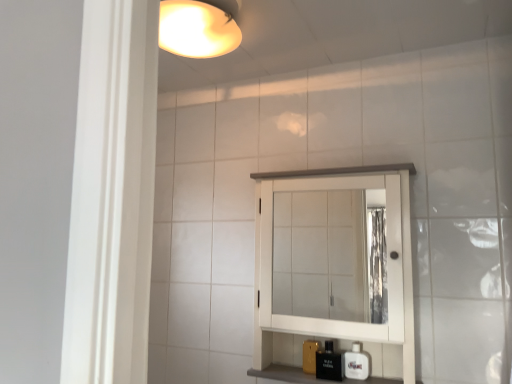
Question: Is white wood medicine cabinet at center bigger or smaller than black glossy bottle at lower center?

Choices:
 (A) small
 (B) big

Answer: (B)

Question: Is white wood medicine cabinet at center taller or shorter than black glossy bottle at lower center?

Choices:
 (A) tall
 (B) short

Answer: (A)

Question: Considering the real-world distances, which object is farthest from the white glossy soap dispenser at lower right?

Choices:
 (A) black glossy bottle at lower center
 (B) white wood medicine cabinet at center

Answer: (B)

Question: Based on their relative distances, which object is farther from the black glossy bottle at lower center?

Choices:
 (A) white wood medicine cabinet at center
 (B) white glossy soap dispenser at lower right

Answer: (A)